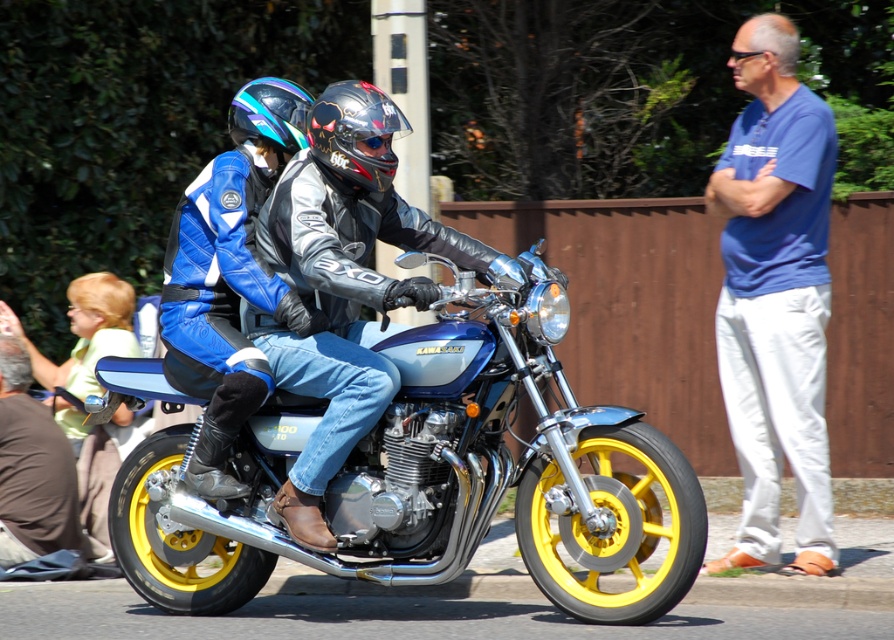
You are a photographer standing at the origin point of the image coordinate system. You want to capture a closeup shot of the brown leather jacket at lower left. What are the coordinates where you should aim your camera?

The coordinates to aim the camera are at point (31, 467) to capture the brown leather jacket at lower left.

Where is the shiny metallic motorcycle at center located in the image?

The shiny metallic motorcycle at center is located at point (436,477) in the image.